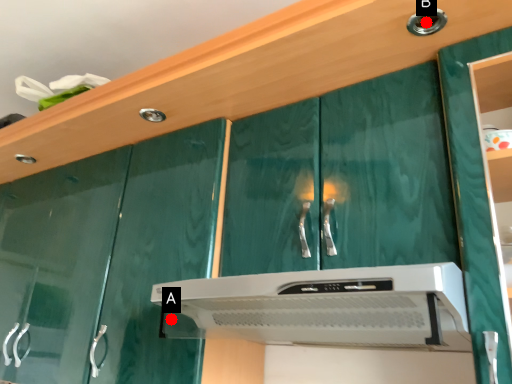
Question: Two points are circled on the image, labeled by A and B beside each circle. Which of the following is the farthest from the observer?

Choices:
 (A) A is further
 (B) B is further

Answer: (A)